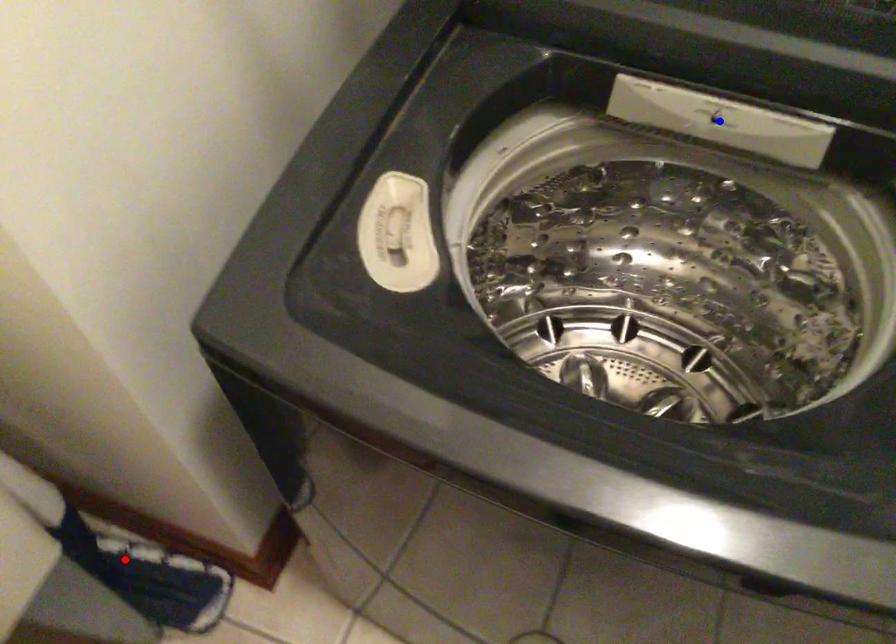
Question: Two points are marked on the image. Which point is closer to the camera?

Choices:
 (A) Blue point is closer.
 (B) Red point is closer.

Answer: (A)